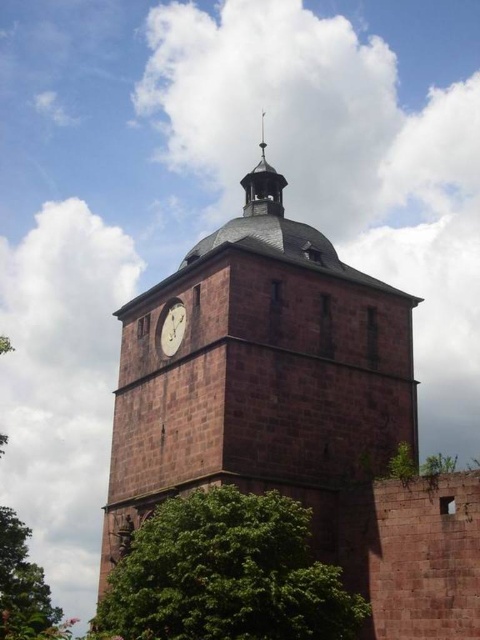
Question: Which object appears closest to the camera in this image?

Choices:
 (A) green leafy tree at lower center
 (B) red brick clock tower at center

Answer: (A)

Question: Is green leafy tree at lower center closer to the viewer compared to white glossy clock at center?

Choices:
 (A) no
 (B) yes

Answer: (B)

Question: Does red brick clock tower at center appear on the right side of green leafy tree at left?

Choices:
 (A) no
 (B) yes

Answer: (B)

Question: Does red brick clock tower at center lie behind green leafy tree at left?

Choices:
 (A) yes
 (B) no

Answer: (B)

Question: Which object is the closest to the red brick clock tower at center?

Choices:
 (A) white glossy clock at center
 (B) green leafy tree at left
 (C) green leafy tree at lower center

Answer: (A)

Question: Which point is farther to the camera?

Choices:
 (A) (195, 522)
 (B) (343, 394)
 (C) (162, 346)

Answer: (C)